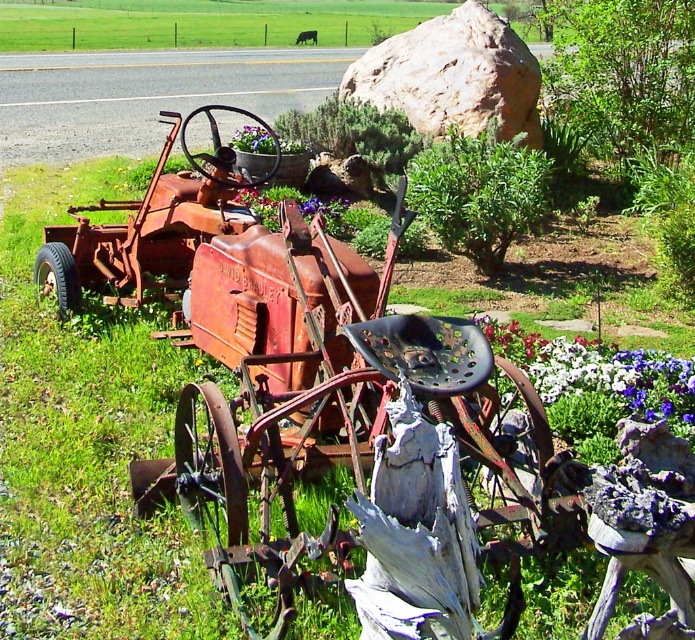
You are a gardener planning to plant new flowers in the purple fabric flower bed at center. You need to ensure that the rustic stone boulder at center won

The rustic stone boulder at center is located above the purple fabric flower bed at center, so you should avoid placing any plants that require space below the boulder to prevent obstruction.

You are standing at the front of the vintage red tractor and want to place a new decorative item. If you move 0.1 units to the right and 0.1 units upward from your current position, will you be near the purple fabric flower at lower right?

The purple fabric flower at lower right is located at point (600, 371). Moving 0.1 units right and up from the tractor would place you at approximately (670, 435), which is not near the flower.

You are a gardener planning to plant a new flower bed. You have a purple fabric flower at lower right and a purple fabric flower bed at center. Which one has a greater width?

The purple fabric flower at lower right has a greater width than the purple fabric flower bed at center.